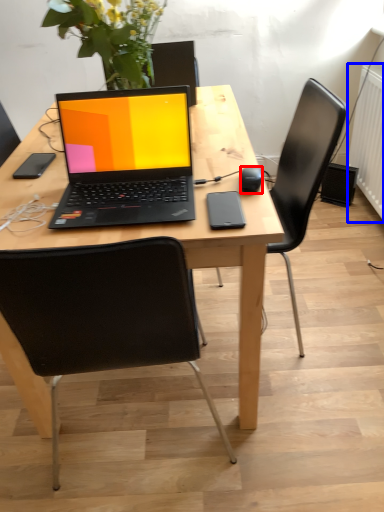
Question: Which of the following is the farthest to the observer, computer mouse (highlighted by a red box) or radiator (highlighted by a blue box)?

Choices:
 (A) computer mouse
 (B) radiator

Answer: (B)